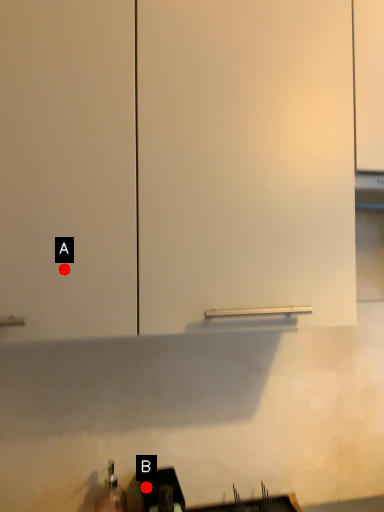
Question: Two points are circled on the image, labeled by A and B beside each circle. Which of the following is the closest to the observer?

Choices:
 (A) A is closer
 (B) B is closer

Answer: (A)